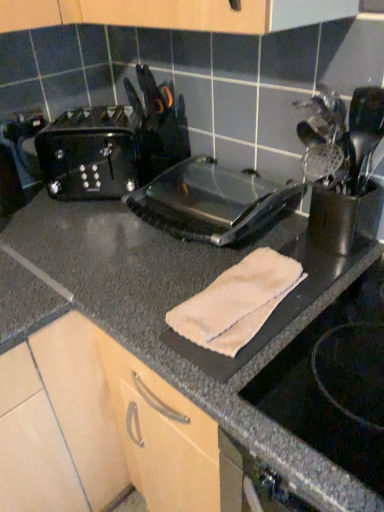
The height and width of the screenshot is (512, 384). In order to click on blank space situated above white fabric at lower right (from a real-world perspective) in this screenshot , I will do `click(337, 364)`.